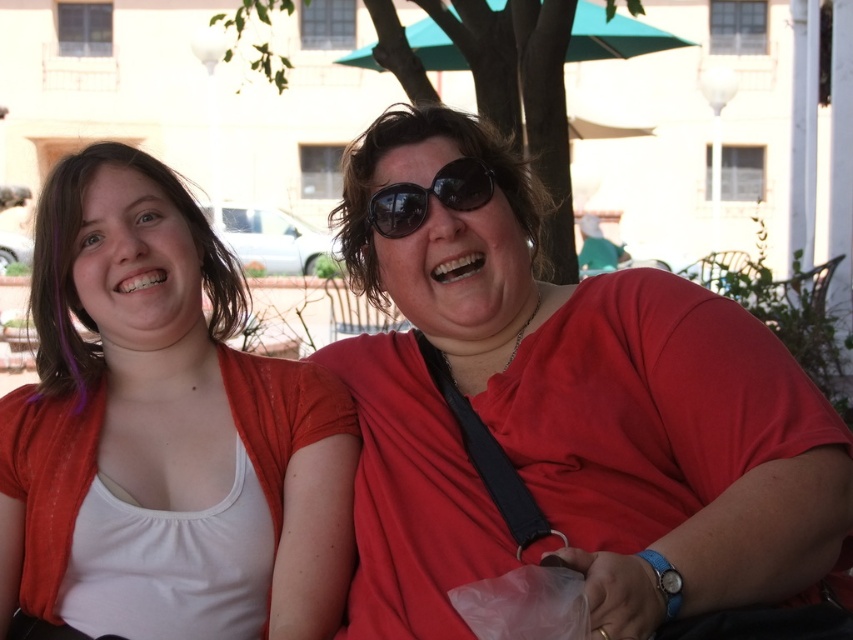
Can you confirm if matte red shirt at center is positioned to the right of white matte tank top at left?

Correct, you'll find matte red shirt at center to the right of white matte tank top at left.

Is point (810, 472) more distant than point (309, 561)?

That is False.

Locate an element on the screen. matte red shirt at center is located at coordinates (567, 417).

Locate an element on the screen. This screenshot has height=640, width=853. matte red shirt at center is located at coordinates (567, 417).

Is matte red shirt at center to the left of black reflective sunglasses at center from the viewer's perspective?

No, matte red shirt at center is not to the left of black reflective sunglasses at center.

Is matte red shirt at center in front of black reflective sunglasses at center?

Yes.

Does point (757, 602) lie in front of point (445, 182)?

Yes, point (757, 602) is in front of point (445, 182).

What are the coordinates of `matte red shirt at center` in the screenshot? It's located at (567, 417).

Which is below, matte red shirt at center or teal fabric umbrella at upper center?

matte red shirt at center is below.

Is point (560, 374) positioned before point (622, 35)?

Yes.

At what (x,y) coordinates should I click in order to perform the action: click on matte red shirt at center. Please return your answer as a coordinate pair (x, y). Image resolution: width=853 pixels, height=640 pixels. Looking at the image, I should click on (567, 417).